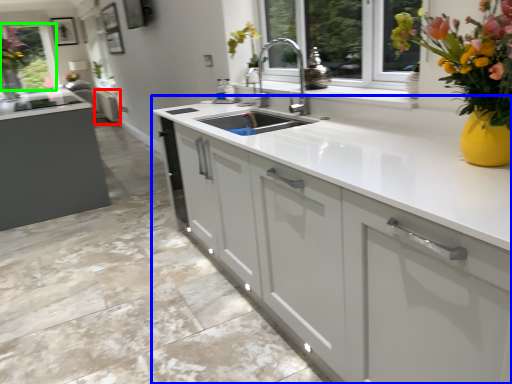
Question: Considering the real-world distances, which object is farthest from cabinetry (highlighted by a red box)? cabinetry (highlighted by a blue box) or window screen (highlighted by a green box)?

Choices:
 (A) cabinetry
 (B) window screen

Answer: (A)